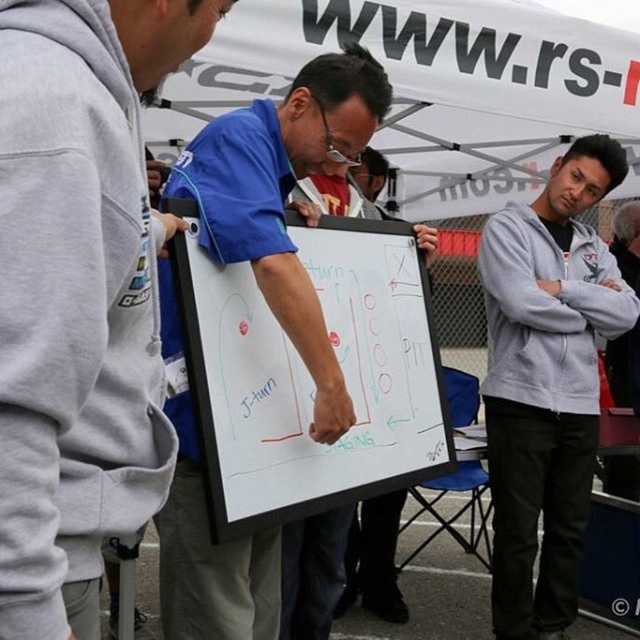
Can you confirm if gray fleece hoodie at left is positioned to the right of whiteboard at center?

In fact, gray fleece hoodie at left is to the left of whiteboard at center.

Does gray fleece hoodie at left have a larger size compared to whiteboard at center?

Yes.

Where is `gray fleece hoodie at left`? The height and width of the screenshot is (640, 640). gray fleece hoodie at left is located at coordinates click(80, 296).

Does white matte clipboard at center appear over whiteboard at center?

Yes.

Who is more forward, (378, 225) or (339, 176)?

Positioned in front is point (378, 225).

The image size is (640, 640). Describe the element at coordinates (308, 374) in the screenshot. I see `white matte clipboard at center` at that location.

The image size is (640, 640). Identify the location of white matte clipboard at center. (308, 374).

Is gray fleece hoodie at left taller than white matte clipboard at center?

Yes.

Find the location of a particular element. gray fleece hoodie at left is located at coordinates (80, 296).